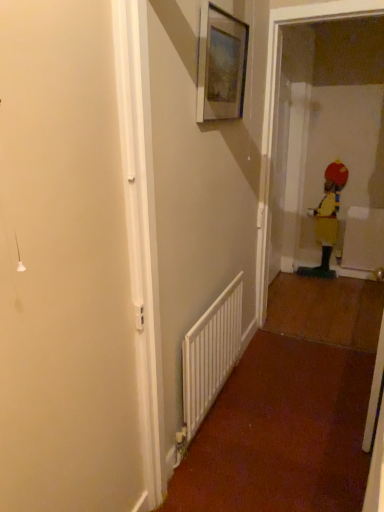
Question: Is point (345, 167) positioned closer to the camera than point (226, 352)?

Choices:
 (A) closer
 (B) farther

Answer: (B)

Question: In terms of size, does yellow fabric toddler at right appear bigger or smaller than white plastic radiator at center?

Choices:
 (A) big
 (B) small

Answer: (A)

Question: Which object is the closest to the matte wooden picture frame at upper center?

Choices:
 (A) white plastic radiator at center
 (B) yellow fabric toddler at right

Answer: (A)

Question: Considering the real-world distances, which object is closest to the white plastic radiator at center?

Choices:
 (A) yellow fabric toddler at right
 (B) matte wooden picture frame at upper center

Answer: (B)